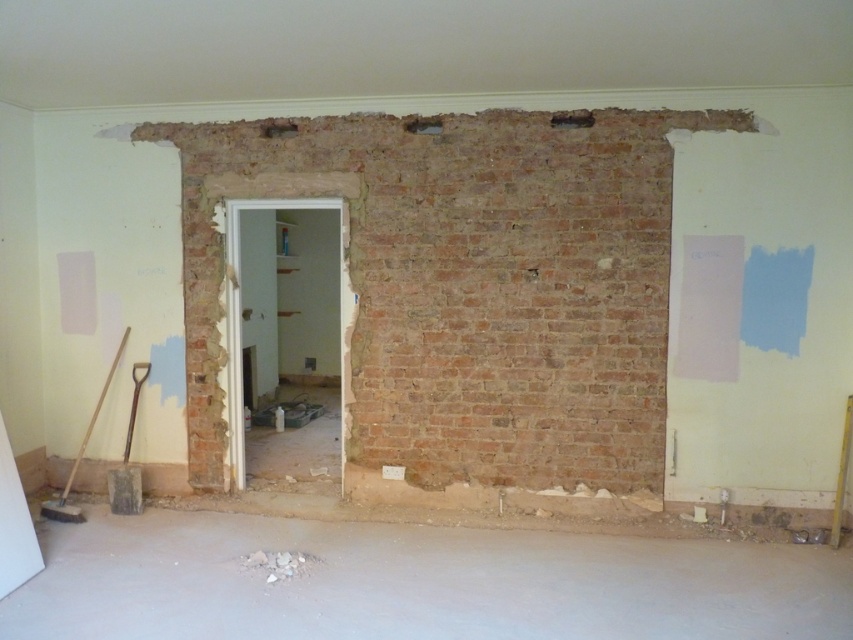
You are a construction worker who needs to access the exposed brick wall behind the partially demolished wall. You see the brick wall hole at upper center and the smooth concrete hole at center. Which hole should you use to reach the brick wall?

The brick wall hole at upper center is located below the smooth concrete hole at center, so you should use the brick wall hole at upper center to reach the brick wall since it is closer to the exposed brick area.

You are a construction worker who needs to move the crumbly concrete debris at lower center and the brick wall hole at upper center to make space for a new electrical outlet. Since you can only move one of them, which object should you choose based on their size?

The crumbly concrete debris at lower center is bigger than the brick wall hole at upper center. Therefore, you should move the crumbly concrete debris at lower center to make space for the new electrical outlet.

You are a construction worker who needs to place a 1.2 meter wide wooden board between the crumbly concrete debris at lower center and the smooth concrete hole at center. Can the board fit horizontally between them?

The crumbly concrete debris at lower center might be wider than the smooth concrete hole at center, so the 1.2 meter board may not fit if the debris is wider than the hole. Check the exact measurements before placing the board.